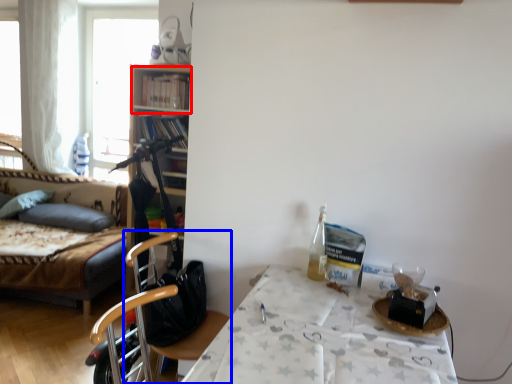
Question: Among these objects, which one is farthest to the camera, shelf (highlighted by a red box) or chair (highlighted by a blue box)?

Choices:
 (A) shelf
 (B) chair

Answer: (A)